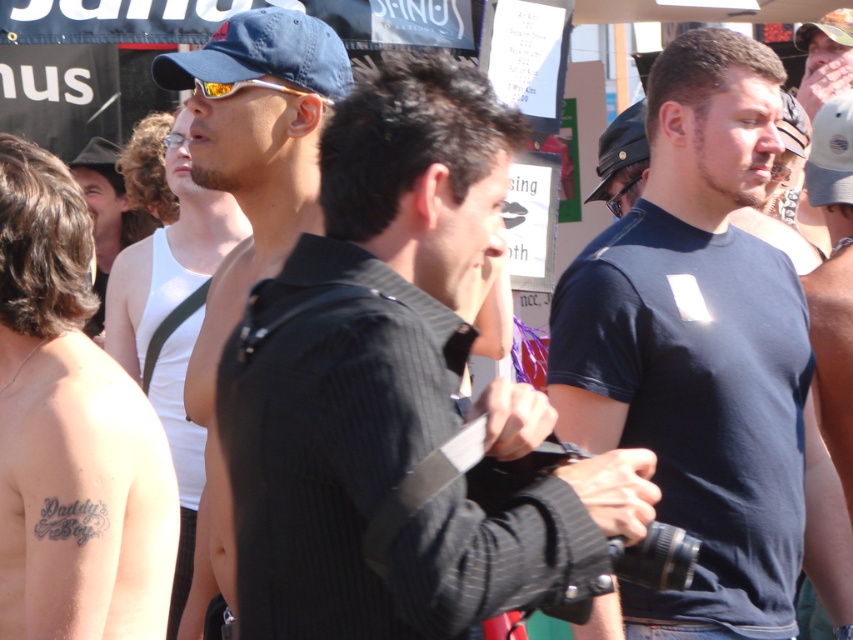
Question: Is shiny skin tattoo at center below matte black tank top at center?

Choices:
 (A) no
 (B) yes

Answer: (B)

Question: Among these points, which one is farthest from the camera?

Choices:
 (A) pos(177,349)
 (B) pos(305,164)
 (C) pos(212,81)

Answer: (A)

Question: Does shiny skin tattoo at center have a smaller size compared to gold reflective sunglasses at upper center?

Choices:
 (A) no
 (B) yes

Answer: (A)

Question: Which of the following is the closest to the observer?

Choices:
 (A) (276, 86)
 (B) (316, 83)
 (C) (762, 288)
 (D) (100, 305)

Answer: (C)

Question: Which point is farther to the camera?

Choices:
 (A) (281, 92)
 (B) (177, 380)

Answer: (B)

Question: Does dark blue t-shirt at center have a larger size compared to blue fabric baseball cap at upper center?

Choices:
 (A) yes
 (B) no

Answer: (A)